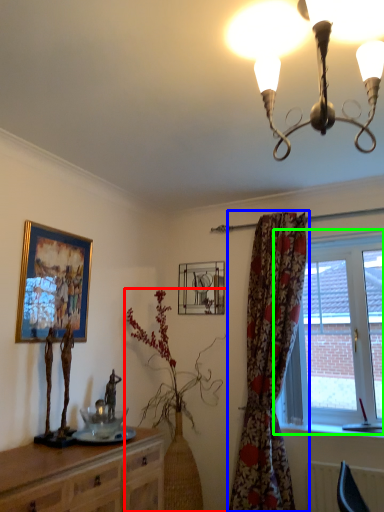
Question: Based on their relative distances, which object is farther from houseplant (highlighted by a red box)? Choose from curtain (highlighted by a blue box) and window (highlighted by a green box).

Choices:
 (A) curtain
 (B) window

Answer: (B)